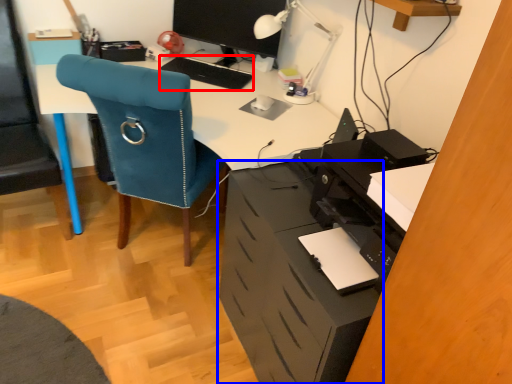
Question: Among these objects, which one is farthest to the camera, keyboard (highlighted by a red box) or file cabinet (highlighted by a blue box)?

Choices:
 (A) keyboard
 (B) file cabinet

Answer: (A)